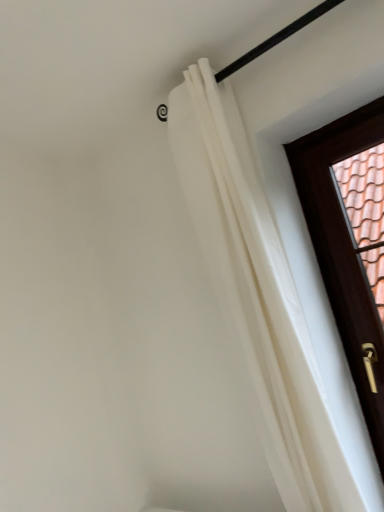
Question: Does white sheer curtain at upper right come in front of brown wooden door at right?

Choices:
 (A) yes
 (B) no

Answer: (A)

Question: Considering the relative positions of white sheer curtain at upper right and brown wooden door at right in the image provided, is white sheer curtain at upper right to the right of brown wooden door at right from the viewer's perspective?

Choices:
 (A) yes
 (B) no

Answer: (B)

Question: From a real-world perspective, is white sheer curtain at upper right positioned over brown wooden door at right based on gravity?

Choices:
 (A) no
 (B) yes

Answer: (B)

Question: Is white sheer curtain at upper right beside brown wooden door at right?

Choices:
 (A) no
 (B) yes

Answer: (A)

Question: Is white sheer curtain at upper right not near brown wooden door at right?

Choices:
 (A) yes
 (B) no

Answer: (A)

Question: From the image's perspective, is white sheer curtain at upper right below brown wooden door at right?

Choices:
 (A) yes
 (B) no

Answer: (B)

Question: Is brown wooden door at right positioned in front of white sheer curtain at upper right?

Choices:
 (A) yes
 (B) no

Answer: (B)

Question: From the image's perspective, is brown wooden door at right above white sheer curtain at upper right?

Choices:
 (A) no
 (B) yes

Answer: (A)

Question: From a real-world perspective, is brown wooden door at right beneath white sheer curtain at upper right?

Choices:
 (A) yes
 (B) no

Answer: (A)

Question: Is brown wooden door at right positioned behind white sheer curtain at upper right?

Choices:
 (A) no
 (B) yes

Answer: (B)

Question: Are brown wooden door at right and white sheer curtain at upper right located far from each other?

Choices:
 (A) yes
 (B) no

Answer: (A)

Question: Considering the relative sizes of brown wooden door at right and white sheer curtain at upper right in the image provided, is brown wooden door at right taller than white sheer curtain at upper right?

Choices:
 (A) yes
 (B) no

Answer: (B)

Question: From a real-world perspective, is white sheer curtain at upper right positioned above or below brown wooden door at right?

Choices:
 (A) above
 (B) below

Answer: (A)